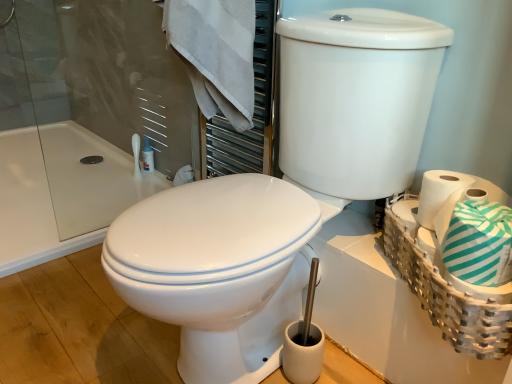
At what (x,y) coordinates should I click in order to perform the action: click on vacant space to the left of white glossy toilet at center, which is the first toilet in right-to-left order. Please return your answer as a coordinate pair (x, y). The image size is (512, 384). Looking at the image, I should click on (69, 309).